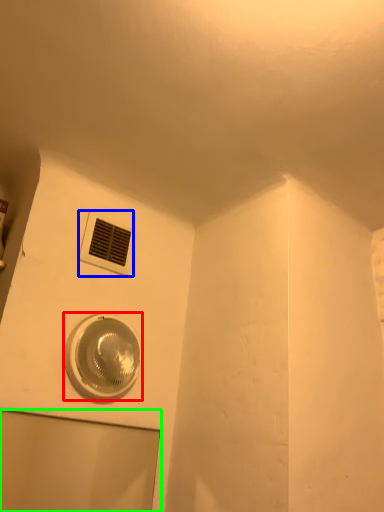
Question: Which is farther away from home appliance (highlighted by a red box)? air conditioning (highlighted by a blue box) or glass door (highlighted by a green box)?

Choices:
 (A) air conditioning
 (B) glass door

Answer: (B)